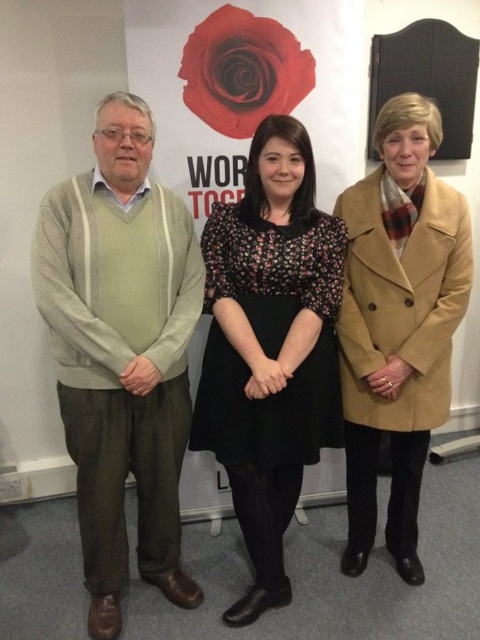
Question: Which of the following is the farthest from the observer?

Choices:
 (A) light beige sweater at left
 (B) tan wool coat at center
 (C) floral-patterned dress at center

Answer: (B)

Question: Can you confirm if floral-patterned dress at center is positioned above tan wool coat at center?

Choices:
 (A) no
 (B) yes

Answer: (A)

Question: Can you confirm if light beige sweater at left is thinner than tan wool coat at center?

Choices:
 (A) no
 (B) yes

Answer: (A)

Question: Among these points, which one is farthest from the camera?

Choices:
 (A) (280, 444)
 (B) (167, 342)

Answer: (A)

Question: Does floral-patterned dress at center appear under tan wool coat at center?

Choices:
 (A) no
 (B) yes

Answer: (B)

Question: Which point appears farthest from the camera in this image?

Choices:
 (A) (232, 420)
 (B) (425, 388)
 (C) (74, 276)

Answer: (B)